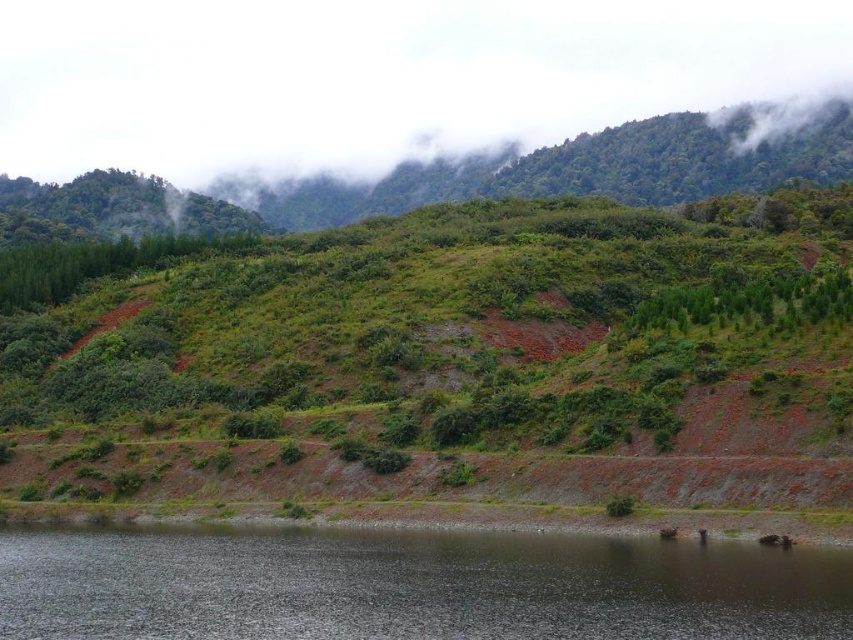
At what (x,y) coordinates should I click in order to perform the action: click on green grassy hillside at center. Please return your answer as a coordinate pair (x, y). This screenshot has width=853, height=640. Looking at the image, I should click on (463, 356).

Which of these two, green grassy hillside at center or dark reflective water at lower center, stands shorter?

Standing shorter between the two is dark reflective water at lower center.

Who is more distant from viewer, (544,212) or (259,561)?

The point (544,212) is more distant.

This screenshot has height=640, width=853. What are the coordinates of `green grassy hillside at center` in the screenshot? It's located at (463, 356).